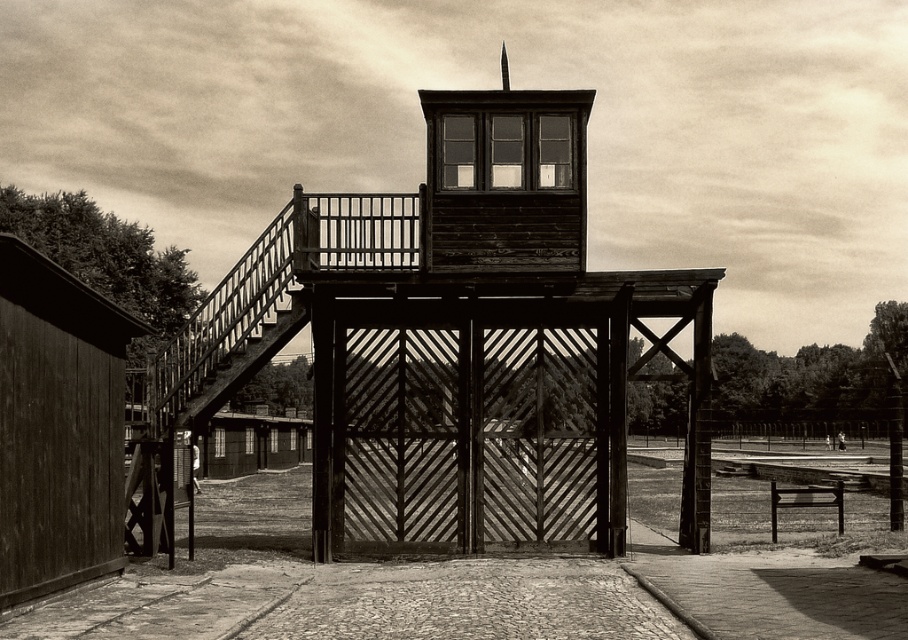
Does wooden gate at center have a larger size compared to wooden bell tower at center?

Correct, wooden gate at center is larger in size than wooden bell tower at center.

Does wooden gate at center have a greater width compared to wooden bell tower at center?

Correct, the width of wooden gate at center exceeds that of wooden bell tower at center.

Between point (472, 157) and point (581, 124), which one is positioned behind?

The point (472, 157) is behind.

I want to click on wooden gate at center, so click(x=450, y=348).